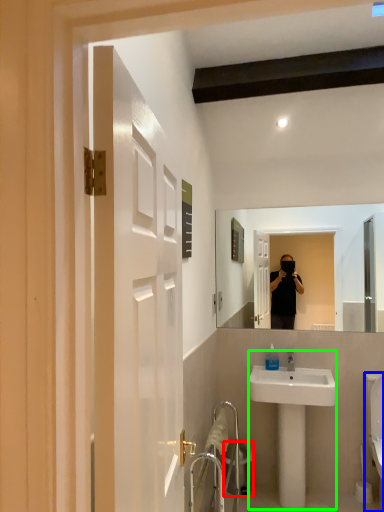
Question: Which object is positioned closest to trash bin/can (highlighted by a red box)? Select from toilet (highlighted by a blue box) and sink (highlighted by a green box).

Choices:
 (A) toilet
 (B) sink

Answer: (B)